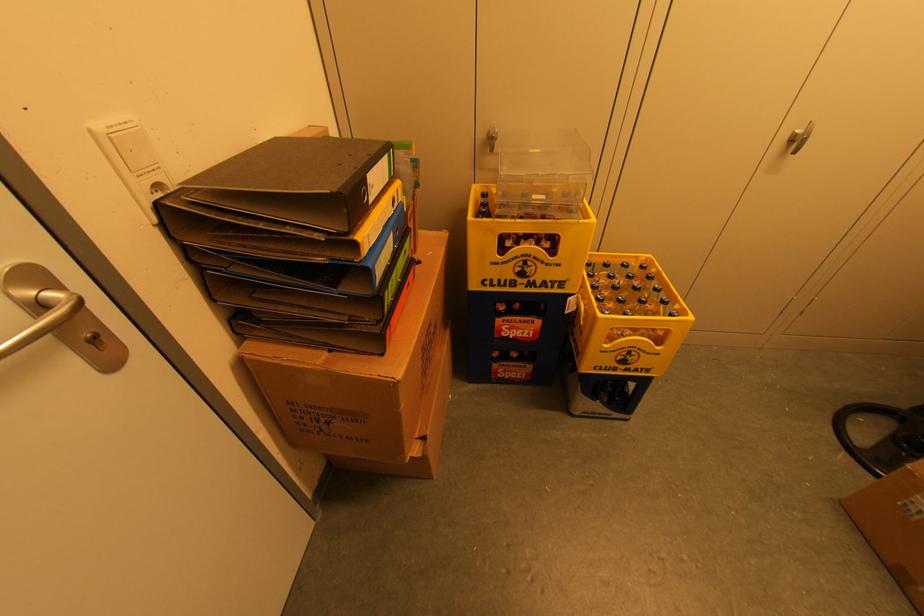
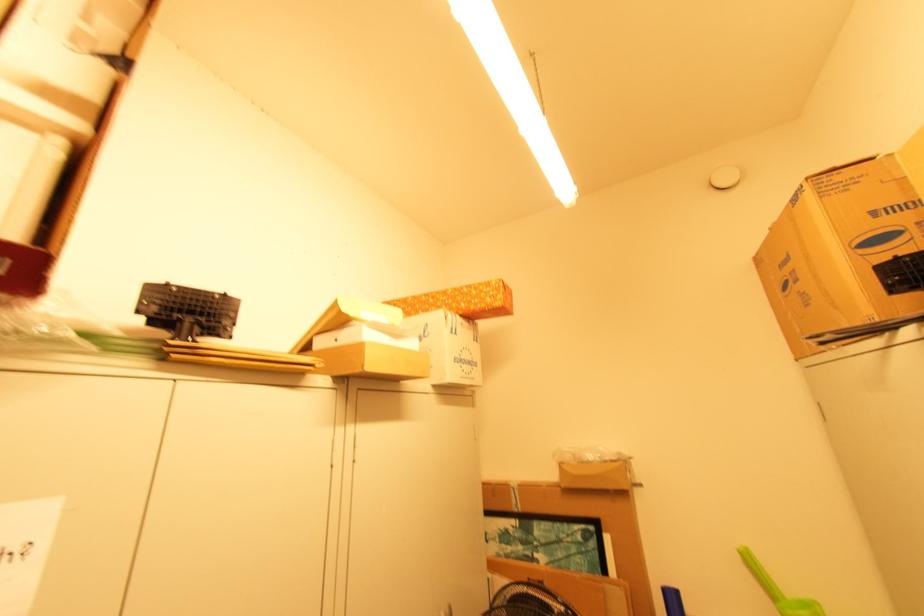
The first image is from the beginning of the video and the second image is from the end. How did the camera likely rotate when shooting the video?

The rotation direction of the camera is right-up.